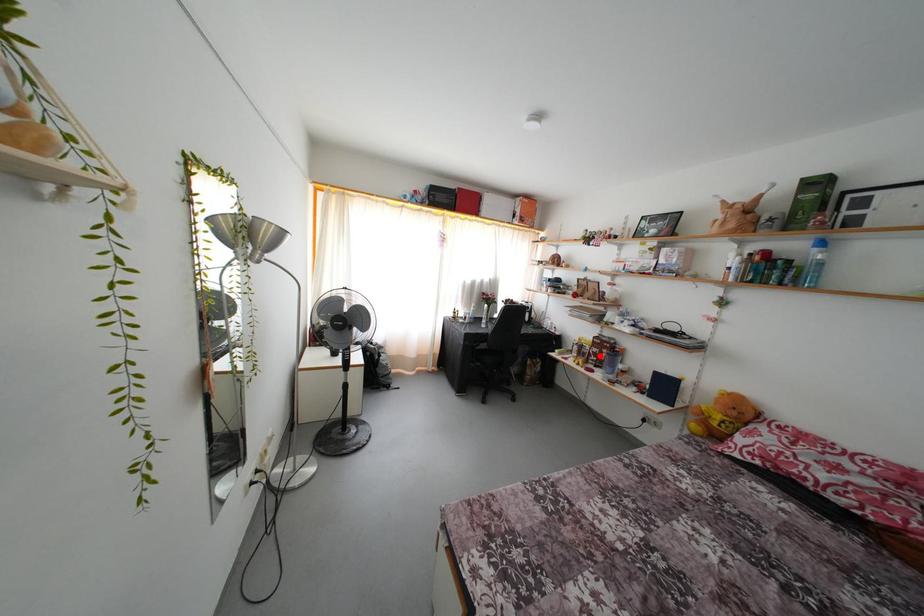
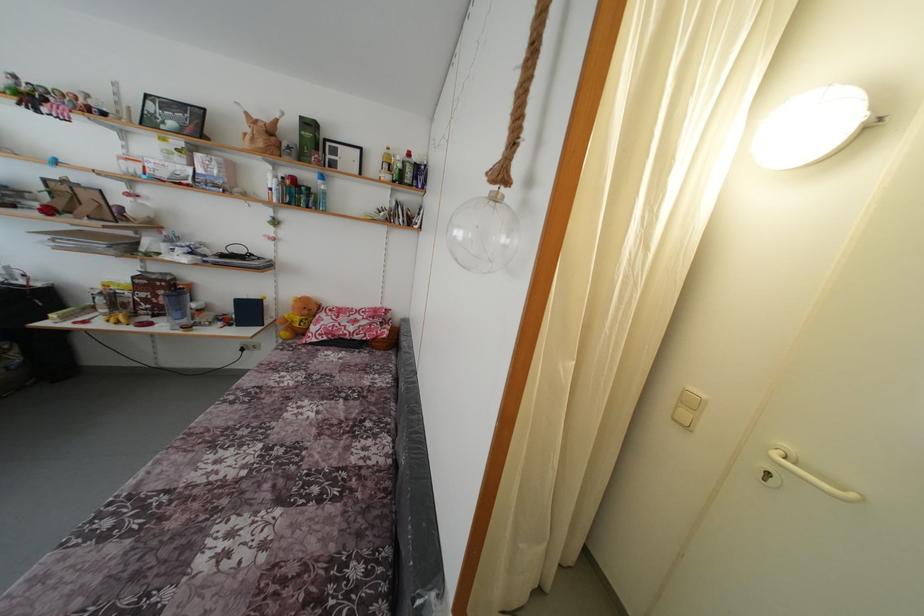
Question: I am providing you with two images of the same scene from different viewpoints. In image1, a red point is highlighted. Considering the same 3D point in image2, which of the following is correct?

Choices:
 (A) It is closer
 (B) It is farther

Answer: (B)